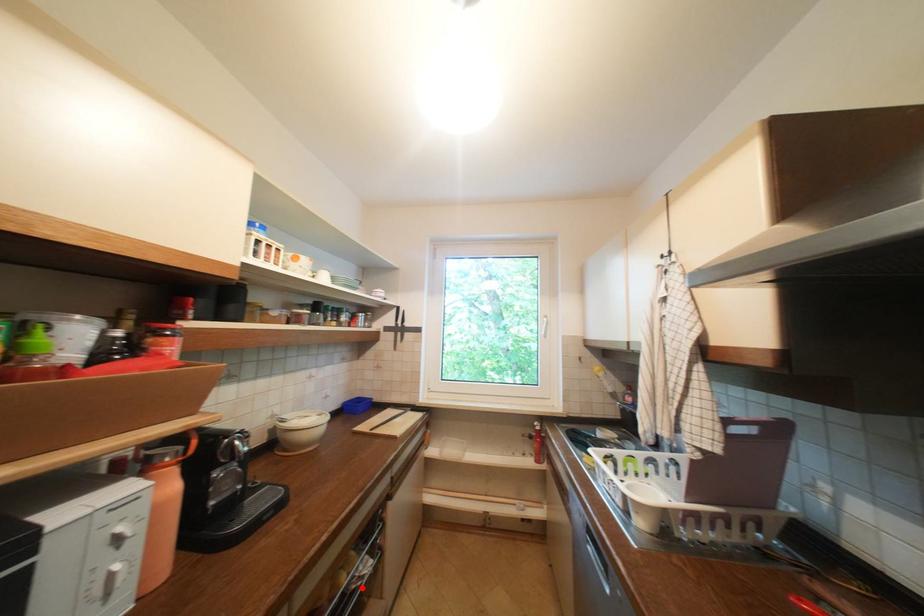
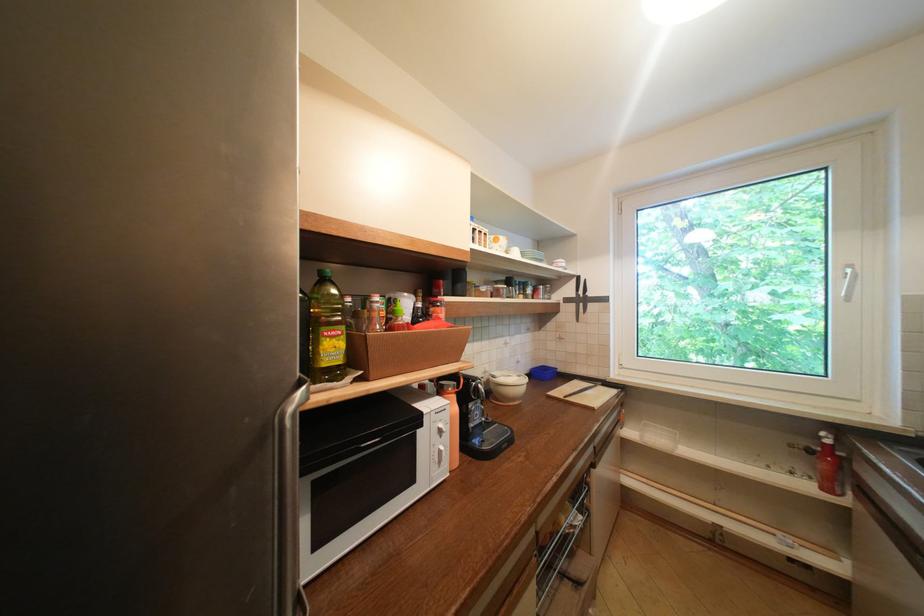
Where in the second image is the point corresponding to the highlighted location from the first image?

(576, 532)